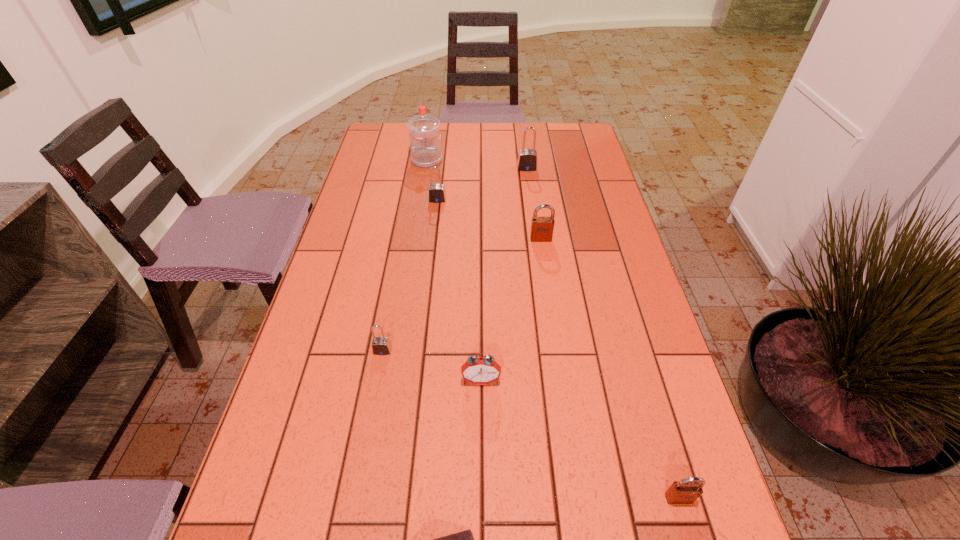
Identify which gray padlock is the nearest to the alarm clock. Please provide its 2D coordinates. Your answer should be formatted as a tuple, i.e. [(x, y)], where the tuple contains the x and y coordinates of a point satisfying the conditions above.

[(380, 345)]

What are the coordinates of `the closest gray padlock to the biggest gray padlock` in the screenshot? It's located at (436, 193).